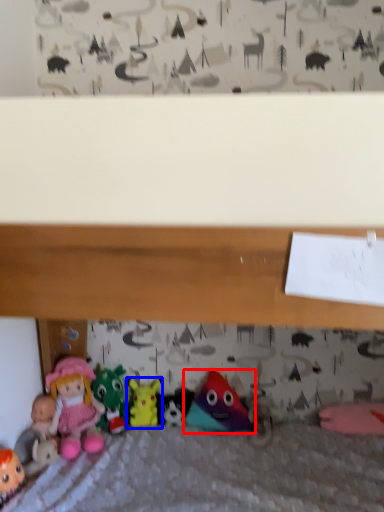
Question: Which point is further to the camera, toy (highlighted by a red box) or toy (highlighted by a blue box)?

Choices:
 (A) toy
 (B) toy

Answer: (B)